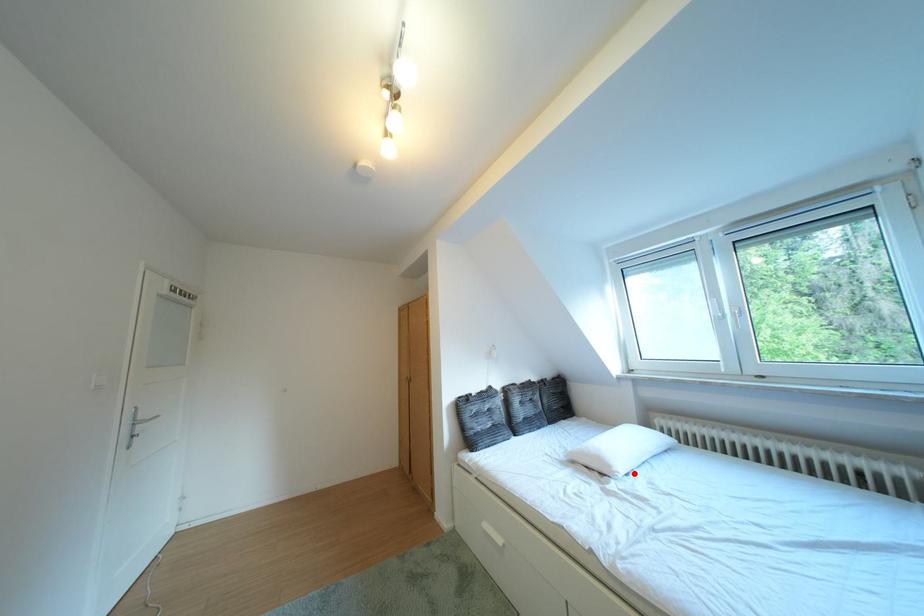
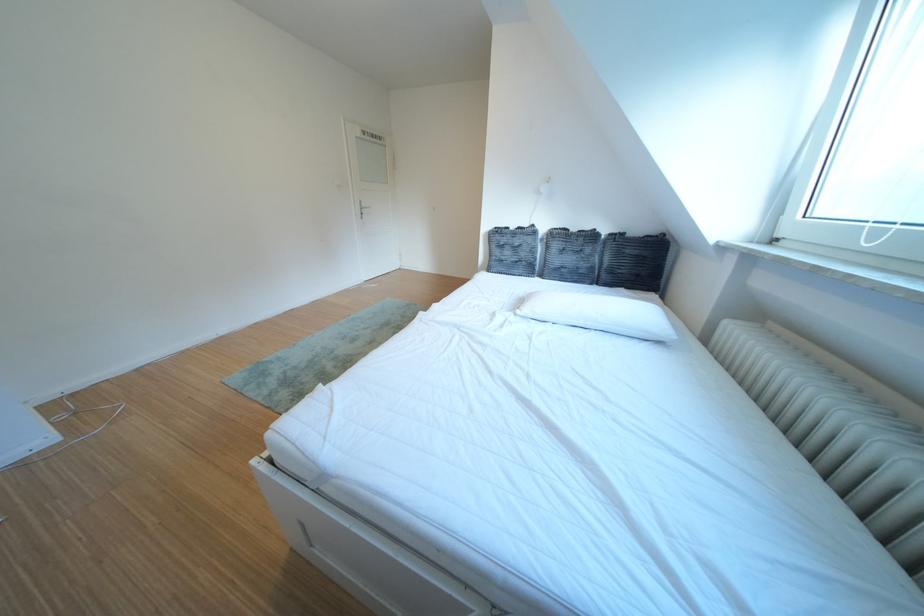
Locate, in the second image, the point that corresponds to the highlighted location in the first image.

(540, 314)